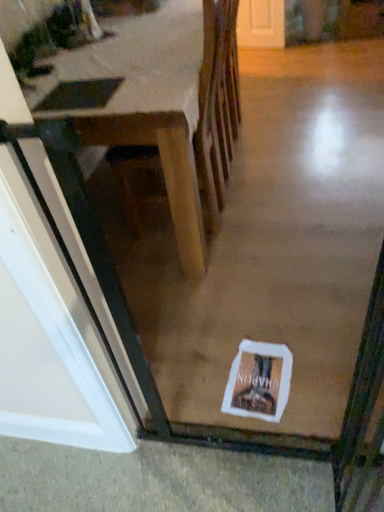
Question: Can you confirm if white paper postcard at center is smaller than wooden table at center?

Choices:
 (A) yes
 (B) no

Answer: (A)

Question: Can you confirm if white paper postcard at center is positioned to the right of wooden table at center?

Choices:
 (A) no
 (B) yes

Answer: (B)

Question: Are white paper postcard at center and wooden table at center far apart?

Choices:
 (A) no
 (B) yes

Answer: (A)

Question: Could you tell me if white paper postcard at center is turned towards wooden table at center?

Choices:
 (A) no
 (B) yes

Answer: (A)

Question: From the image's perspective, would you say white paper postcard at center is shown under wooden table at center?

Choices:
 (A) yes
 (B) no

Answer: (A)

Question: Considering the relative positions of white paper postcard at center and wooden table at center in the image provided, is white paper postcard at center to the left of wooden table at center from the viewer's perspective?

Choices:
 (A) yes
 (B) no

Answer: (B)

Question: Can you confirm if wooden table at center is positioned to the left of white paper postcard at center?

Choices:
 (A) no
 (B) yes

Answer: (B)

Question: From a real-world perspective, does wooden table at center sit lower than white paper postcard at center?

Choices:
 (A) yes
 (B) no

Answer: (B)

Question: From the image's perspective, is wooden table at center located above white paper postcard at center?

Choices:
 (A) yes
 (B) no

Answer: (A)

Question: Considering the relative sizes of wooden table at center and white paper postcard at center in the image provided, is wooden table at center wider than white paper postcard at center?

Choices:
 (A) no
 (B) yes

Answer: (B)

Question: From the image's perspective, is wooden table at center located beneath white paper postcard at center?

Choices:
 (A) yes
 (B) no

Answer: (B)

Question: From a real-world perspective, is wooden table at center on white paper postcard at center?

Choices:
 (A) yes
 (B) no

Answer: (A)

Question: Is white paper postcard at center wider or thinner than wooden table at center?

Choices:
 (A) thin
 (B) wide

Answer: (A)